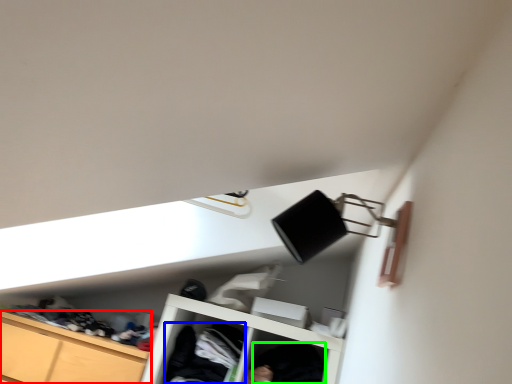
Question: Based on their relative distances, which object is nearer to cabinetry (highlighted by a red box)? Choose from clothing (highlighted by a blue box) and clothing (highlighted by a green box).

Choices:
 (A) clothing
 (B) clothing

Answer: (A)